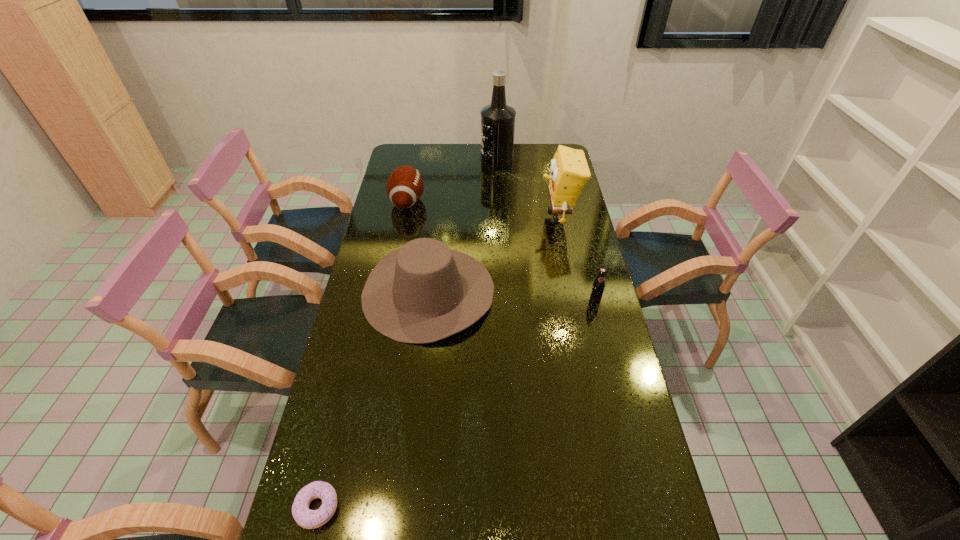
Locate an element on the screen. The width and height of the screenshot is (960, 540). football that is at the left edge is located at coordinates (404, 186).

Where is `doughnut that is positioned at the left edge`? doughnut that is positioned at the left edge is located at coordinates (310, 519).

The height and width of the screenshot is (540, 960). Identify the location of sponge that is at the right edge. (569, 171).

The width and height of the screenshot is (960, 540). I want to click on pop located at the right edge, so click(598, 287).

Image resolution: width=960 pixels, height=540 pixels. Identify the location of vacant space at the far edge. (498, 170).

What are the coordinates of `free space at the left edge of the desktop` in the screenshot? It's located at (355, 493).

The height and width of the screenshot is (540, 960). Identify the location of blank space at the right edge. (598, 361).

I want to click on free space at the far left corner of the desktop, so click(399, 154).

In the image, there is a desktop. Where is `vacant area at the far right corner`? Image resolution: width=960 pixels, height=540 pixels. vacant area at the far right corner is located at coordinates (562, 145).

Locate an element on the screen. free space between the farthest object and the football is located at coordinates (452, 181).